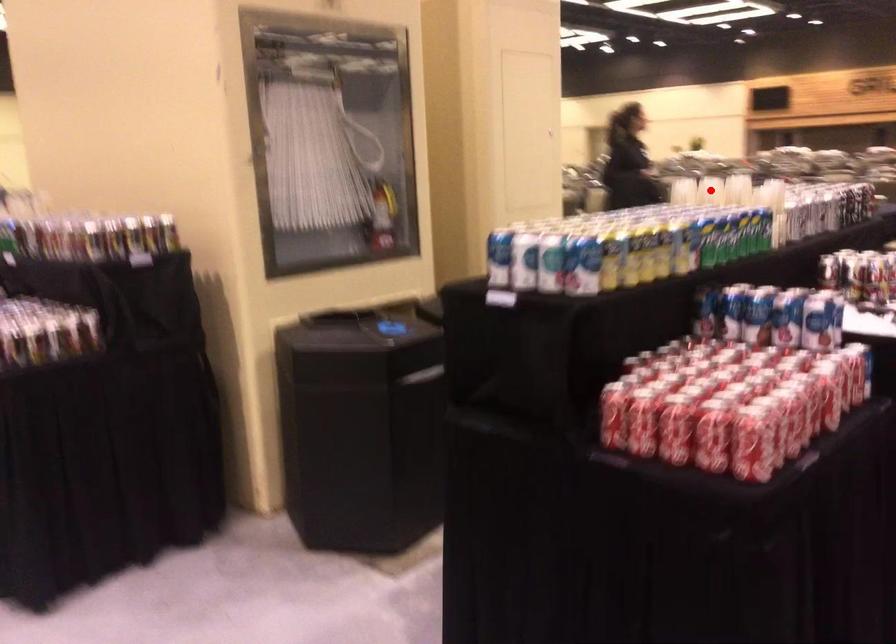
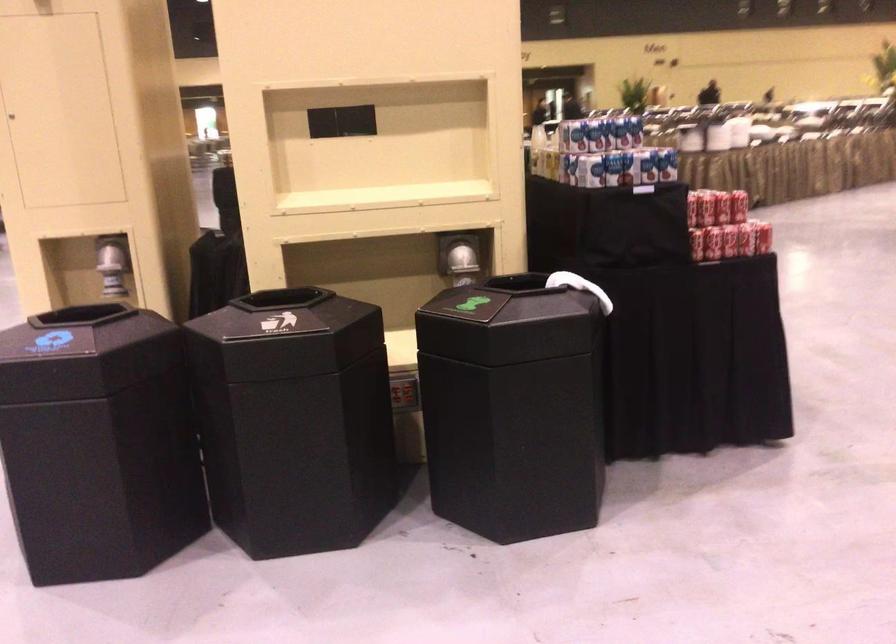
Question: I am providing you with two images of the same scene from different viewpoints. A red point is marked on the first image. At the location where the point appears in image 1, is it still visible in image 2?

Choices:
 (A) Yes
 (B) No

Answer: (B)